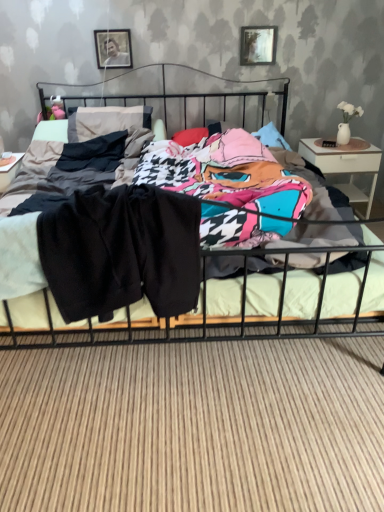
The width and height of the screenshot is (384, 512). What do you see at coordinates (258, 45) in the screenshot?
I see `metallic silver picture frame at upper center, the 2th picture frame in the left-to-right sequence` at bounding box center [258, 45].

The width and height of the screenshot is (384, 512). What do you see at coordinates (121, 251) in the screenshot?
I see `black cotton pants at center` at bounding box center [121, 251].

Locate an element on the screen. This screenshot has height=512, width=384. metallic silver picture frame at upper center, the 2th picture frame in the left-to-right sequence is located at coordinates click(x=258, y=45).

Can you see metallic silver picture frame at upper center, which ranks as the second picture frame in right-to-left order, touching black cotton pants at center?

They are not placed beside each other.

Considering the sizes of objects metallic silver picture frame at upper center, the 1th picture frame in the left-to-right sequence, and black cotton pants at center in the image provided, who is shorter, metallic silver picture frame at upper center, the 1th picture frame in the left-to-right sequence, or black cotton pants at center?

metallic silver picture frame at upper center, the 1th picture frame in the left-to-right sequence.

Which is behind, metallic silver picture frame at upper center, the 1th picture frame in the left-to-right sequence, or black cotton pants at center?

metallic silver picture frame at upper center, the 1th picture frame in the left-to-right sequence, is further from the camera.

From the picture: From the image's perspective, which object appears higher, metallic silver picture frame at upper center, the 1th picture frame in the left-to-right sequence, or black cotton pants at center?

metallic silver picture frame at upper center, the 1th picture frame in the left-to-right sequence, appears higher in the image.

In the scene shown: Is metallic black bed at center at the left side of white glossy nightstand at right?

Indeed, metallic black bed at center is positioned on the left side of white glossy nightstand at right.

From their relative heights in the image, would you say metallic black bed at center is taller or shorter than white glossy nightstand at right?

metallic black bed at center is taller than white glossy nightstand at right.

Is metallic black bed at center far from white glossy nightstand at right?

metallic black bed at center is positioned a significant distance from white glossy nightstand at right.

Does metallic black bed at center contain white glossy nightstand at right?

Actually, white glossy nightstand at right is outside metallic black bed at center.

Considering the sizes of objects metallic silver picture frame at upper center, which is the first picture frame in right-to-left order, and white glossy nightstand at right in the image provided, who is taller, metallic silver picture frame at upper center, which is the first picture frame in right-to-left order, or white glossy nightstand at right?

Standing taller between the two is white glossy nightstand at right.

What's the angular difference between metallic silver picture frame at upper center, which is the first picture frame in right-to-left order, and white glossy nightstand at right's facing directions?

0.855 degrees separate the facing orientations of metallic silver picture frame at upper center, which is the first picture frame in right-to-left order, and white glossy nightstand at right.

From the image's perspective, is metallic silver picture frame at upper center, the 2th picture frame in the left-to-right sequence, beneath white glossy nightstand at right?

No.

Is the position of metallic silver picture frame at upper center, which is the first picture frame in right-to-left order, more distant than that of white glossy nightstand at right?

Yes.

Considering the relative sizes of metallic black bed at center and black cotton pants at center in the image provided, is metallic black bed at center thinner than black cotton pants at center?

Incorrect, the width of metallic black bed at center is not less than that of black cotton pants at center.

In the image, is metallic black bed at center positioned in front of or behind black cotton pants at center?

Visually, metallic black bed at center is located in front of black cotton pants at center.

What's the angular difference between metallic black bed at center and black cotton pants at center's facing directions?

The angle between the facing direction of metallic black bed at center and the facing direction of black cotton pants at center is 3.6 degrees.

Is black cotton pants at center at the back of metallic black bed at center?

No, metallic black bed at center is not facing the opposite direction of black cotton pants at center.

Looking at this image, who is shorter, metallic silver picture frame at upper center, which is the first picture frame in right-to-left order, or metallic black bed at center?

metallic silver picture frame at upper center, which is the first picture frame in right-to-left order, is shorter.

The width and height of the screenshot is (384, 512). In order to click on picture frame on the right of metallic black bed at center in this screenshot , I will do `click(258, 45)`.

From a real-world perspective, is metallic silver picture frame at upper center, which is the first picture frame in right-to-left order, physically located above or below metallic black bed at center?

From a real-world perspective, metallic silver picture frame at upper center, which is the first picture frame in right-to-left order, is physically above metallic black bed at center.

Is metallic silver picture frame at upper center, which is the first picture frame in right-to-left order, facing towards metallic black bed at center?

No.

Is metallic silver picture frame at upper center, which ranks as the second picture frame in right-to-left order, far away from metallic silver picture frame at upper center, which is the first picture frame in right-to-left order?

No.

Is metallic silver picture frame at upper center, which ranks as the second picture frame in right-to-left order, not within metallic silver picture frame at upper center, which is the first picture frame in right-to-left order?

Absolutely, metallic silver picture frame at upper center, which ranks as the second picture frame in right-to-left order, is external to metallic silver picture frame at upper center, which is the first picture frame in right-to-left order.

Is metallic silver picture frame at upper center, the 1th picture frame in the left-to-right sequence, taller than metallic silver picture frame at upper center, the 2th picture frame in the left-to-right sequence?

In fact, metallic silver picture frame at upper center, the 1th picture frame in the left-to-right sequence, may be shorter than metallic silver picture frame at upper center, the 2th picture frame in the left-to-right sequence.

Does metallic silver picture frame at upper center, which ranks as the second picture frame in right-to-left order, have a smaller size compared to metallic silver picture frame at upper center, which is the first picture frame in right-to-left order?

Incorrect, metallic silver picture frame at upper center, which ranks as the second picture frame in right-to-left order, is not smaller in size than metallic silver picture frame at upper center, which is the first picture frame in right-to-left order.

From a real-world perspective, between white glossy nightstand at right and metallic black bed at center, who is vertically higher?

metallic black bed at center is physically above.

Based on their positions, is white glossy nightstand at right located to the left or right of metallic black bed at center?

white glossy nightstand at right is to the right of metallic black bed at center.

Find the location of a particular element. This screenshot has width=384, height=512. nightstand above the metallic black bed at center (from the image's perspective) is located at coordinates (345, 164).

The image size is (384, 512). Find the location of `clothing on the right of metallic silver picture frame at upper center, which ranks as the second picture frame in right-to-left order`. clothing on the right of metallic silver picture frame at upper center, which ranks as the second picture frame in right-to-left order is located at coordinates pyautogui.click(x=121, y=251).

Identify the location of nightstand above the metallic black bed at center (from the image's perspective). This screenshot has height=512, width=384. (345, 164).

Considering their positions, is black cotton pants at center positioned closer to metallic silver picture frame at upper center, which ranks as the second picture frame in right-to-left order, than white glossy nightstand at right?

white glossy nightstand at right is closer to metallic silver picture frame at upper center, which ranks as the second picture frame in right-to-left order.

Which object lies nearer to the anchor point metallic silver picture frame at upper center, the 1th picture frame in the left-to-right sequence, white glossy nightstand at right or metallic silver picture frame at upper center, the 2th picture frame in the left-to-right sequence?

metallic silver picture frame at upper center, the 2th picture frame in the left-to-right sequence, is closer to metallic silver picture frame at upper center, the 1th picture frame in the left-to-right sequence.

From the image, which object appears to be nearer to black cotton pants at center, white glossy nightstand at right or metallic silver picture frame at upper center, the 2th picture frame in the left-to-right sequence?

white glossy nightstand at right is positioned closer to the anchor black cotton pants at center.

In the scene shown: Looking at the image, which one is located further to metallic silver picture frame at upper center, which ranks as the second picture frame in right-to-left order, metallic black bed at center or metallic silver picture frame at upper center, which is the first picture frame in right-to-left order?

The object further to metallic silver picture frame at upper center, which ranks as the second picture frame in right-to-left order, is metallic black bed at center.

From the picture: From the image, which object appears to be nearer to white glossy nightstand at right, metallic black bed at center or black cotton pants at center?

Based on the image, metallic black bed at center appears to be nearer to white glossy nightstand at right.

Considering their positions, is metallic black bed at center positioned further to metallic silver picture frame at upper center, the 2th picture frame in the left-to-right sequence, than metallic silver picture frame at upper center, which ranks as the second picture frame in right-to-left order?

The object further to metallic silver picture frame at upper center, the 2th picture frame in the left-to-right sequence, is metallic black bed at center.

Which object lies further to the anchor point metallic silver picture frame at upper center, the 1th picture frame in the left-to-right sequence, metallic silver picture frame at upper center, the 2th picture frame in the left-to-right sequence, or metallic black bed at center?

Among the two, metallic black bed at center is located further to metallic silver picture frame at upper center, the 1th picture frame in the left-to-right sequence.

Considering their positions, is white glossy nightstand at right positioned closer to black cotton pants at center than metallic silver picture frame at upper center, the 1th picture frame in the left-to-right sequence?

The object closer to black cotton pants at center is white glossy nightstand at right.

Find the location of a particular element. The height and width of the screenshot is (512, 384). picture frame between metallic silver picture frame at upper center, which ranks as the second picture frame in right-to-left order, and white glossy nightstand at right, in the horizontal direction is located at coordinates (258, 45).

Identify the location of nightstand between black cotton pants at center and metallic silver picture frame at upper center, the 1th picture frame in the left-to-right sequence, along the z-axis. Image resolution: width=384 pixels, height=512 pixels. (345, 164).

The height and width of the screenshot is (512, 384). What are the coordinates of `picture frame located between black cotton pants at center and metallic silver picture frame at upper center, which is the first picture frame in right-to-left order, in the depth direction` in the screenshot? It's located at (113, 48).

Where is `clothing positioned between metallic black bed at center and white glossy nightstand at right from near to far`? The height and width of the screenshot is (512, 384). clothing positioned between metallic black bed at center and white glossy nightstand at right from near to far is located at coordinates (121, 251).